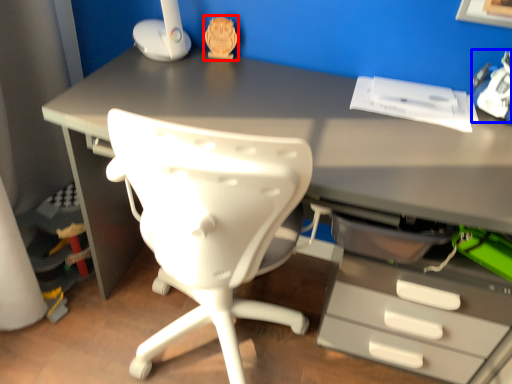
Question: Which object is closer to the camera taking this photo, toy (highlighted by a red box) or toy (highlighted by a blue box)?

Choices:
 (A) toy
 (B) toy

Answer: (B)